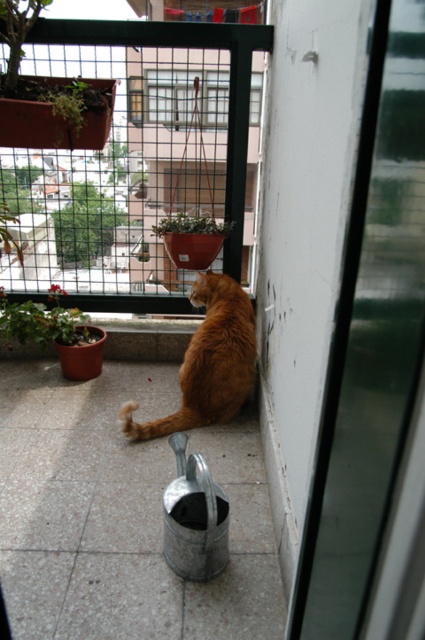
Question: Estimate the real-world distances between objects in this image. Which object is farther from the orange fur cat at center?

Choices:
 (A) green leafy plant at upper left
 (B) green matte plant at lower left
 (C) transparent glass screen door at upper right

Answer: (C)

Question: Which of these objects is positioned farthest from the green leafy plant at upper left?

Choices:
 (A) transparent glass screen door at upper right
 (B) green matte plant at lower left
 (C) orange fur cat at center

Answer: (A)

Question: Can you confirm if orange fur cat at center is bigger than green leafy plant at upper left?

Choices:
 (A) no
 (B) yes

Answer: (B)

Question: Can you confirm if green matte plant at lower left is bigger than green leafy plant at upper left?

Choices:
 (A) no
 (B) yes

Answer: (B)

Question: Is transparent glass screen door at upper right wider than green matte plant at lower left?

Choices:
 (A) yes
 (B) no

Answer: (B)

Question: Which point appears closest to the camera in this image?

Choices:
 (A) (195, 218)
 (B) (33, 305)
 (C) (34, 17)

Answer: (C)